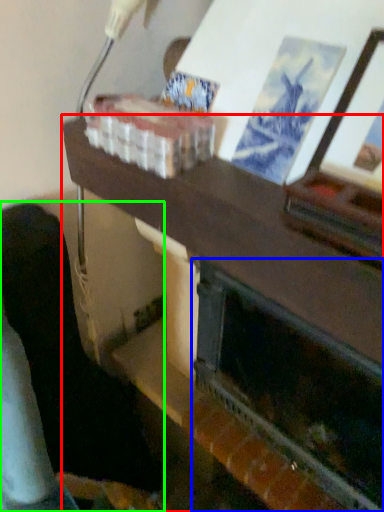
Question: Estimate the real-world distances between objects in this image. Which object is farther from table (highlighted by a red box), fireplace (highlighted by a blue box) or furniture (highlighted by a green box)?

Choices:
 (A) fireplace
 (B) furniture

Answer: (B)